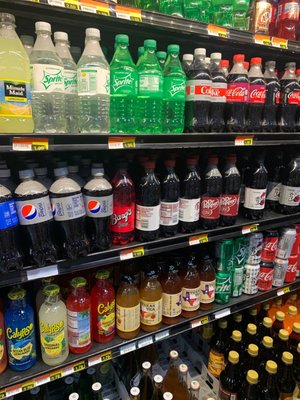
I want to click on shelves, so click(166, 139), click(175, 241), click(243, 37), click(176, 330).